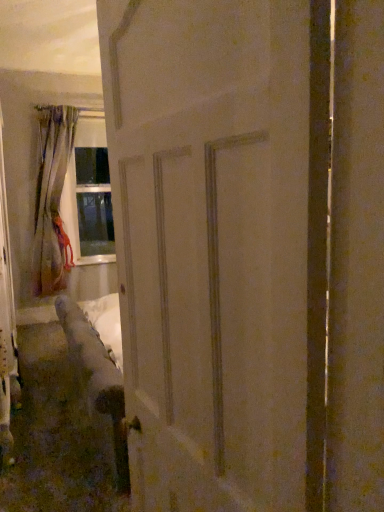
Question: Is white matte door at center at the left side of beige fabric curtain at left?

Choices:
 (A) yes
 (B) no

Answer: (B)

Question: Is white matte door at center turned away from beige fabric curtain at left?

Choices:
 (A) yes
 (B) no

Answer: (B)

Question: From a real-world perspective, does white matte door at center sit lower than beige fabric curtain at left?

Choices:
 (A) no
 (B) yes

Answer: (B)

Question: Is beige fabric curtain at left located within white matte door at center?

Choices:
 (A) no
 (B) yes

Answer: (A)

Question: Does white matte door at center have a smaller size compared to beige fabric curtain at left?

Choices:
 (A) no
 (B) yes

Answer: (B)

Question: From the image's perspective, is white matte door at center located beneath beige fabric curtain at left?

Choices:
 (A) yes
 (B) no

Answer: (A)

Question: Is beige fabric curtain at left positioned beyond the bounds of white matte door at center?

Choices:
 (A) no
 (B) yes

Answer: (B)

Question: Does beige fabric curtain at left have a greater width compared to white matte door at center?

Choices:
 (A) no
 (B) yes

Answer: (B)

Question: Is beige fabric curtain at left positioned with its back to white matte door at center?

Choices:
 (A) yes
 (B) no

Answer: (B)

Question: Does beige fabric curtain at left have a lesser height compared to white matte door at center?

Choices:
 (A) no
 (B) yes

Answer: (A)

Question: Is beige fabric curtain at left placed right next to white matte door at center?

Choices:
 (A) no
 (B) yes

Answer: (A)

Question: From the image's perspective, is beige fabric curtain at left located beneath white matte door at center?

Choices:
 (A) no
 (B) yes

Answer: (A)

Question: Is white matte door at center inside or outside of beige fabric curtain at left?

Choices:
 (A) outside
 (B) inside

Answer: (A)